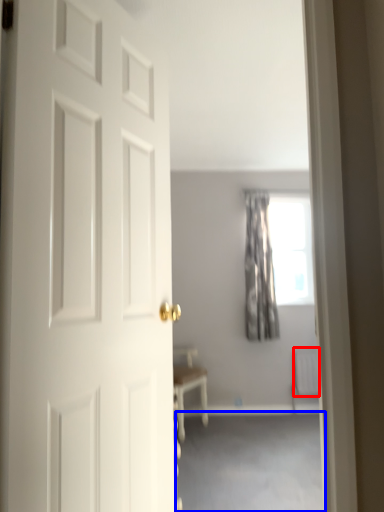
Question: Among these objects, which one is nearest to the camera, radiator (highlighted by a red box) or corridor (highlighted by a blue box)?

Choices:
 (A) radiator
 (B) corridor

Answer: (B)